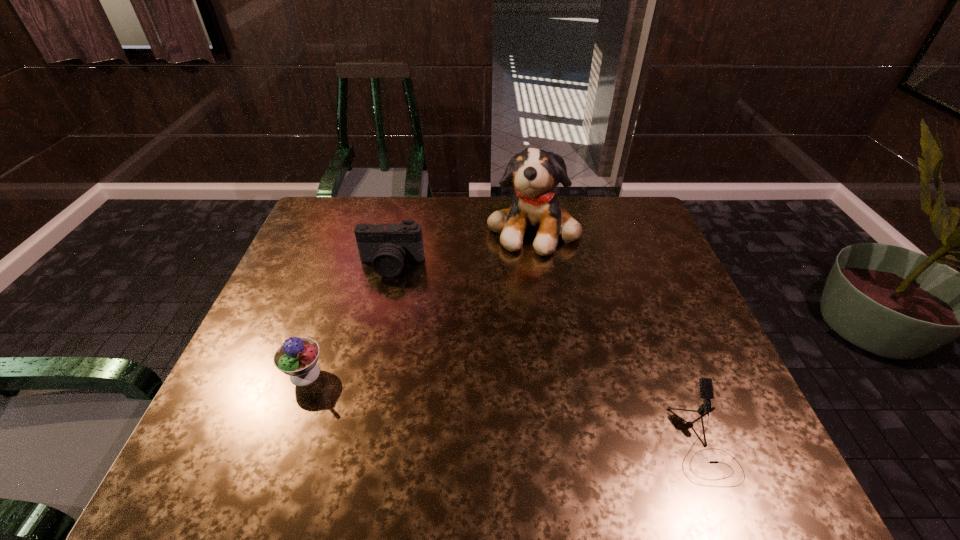
At what (x,y) coordinates should I click in order to perform the action: click on object that is at the near edge. Please return your answer as a coordinate pair (x, y). The width and height of the screenshot is (960, 540). Looking at the image, I should click on (706, 387).

The width and height of the screenshot is (960, 540). Identify the location of object situated at the left edge. (297, 357).

Where is `object present at the right edge`? The width and height of the screenshot is (960, 540). object present at the right edge is located at coordinates (706, 387).

Identify the location of object that is at the near right corner. Image resolution: width=960 pixels, height=540 pixels. click(706, 387).

At what (x,y) coordinates should I click in order to perform the action: click on vacant space at the far edge of the desktop. Please return your answer as a coordinate pair (x, y). Looking at the image, I should click on click(482, 227).

At what (x,y) coordinates should I click in order to perform the action: click on vacant space at the near edge of the desktop. Please return your answer as a coordinate pair (x, y). Looking at the image, I should click on (459, 460).

At what (x,y) coordinates should I click in order to perform the action: click on vacant space at the left edge. Please return your answer as a coordinate pair (x, y). The width and height of the screenshot is (960, 540). Looking at the image, I should click on (292, 397).

In the image, there is a desktop. Identify the location of vacant space at the right edge. click(x=678, y=377).

This screenshot has height=540, width=960. Identify the location of free space at the near left corner. (239, 485).

At what (x,y) coordinates should I click in order to perform the action: click on vacant space at the far right corner. Please return your answer as a coordinate pair (x, y). Looking at the image, I should click on (633, 211).